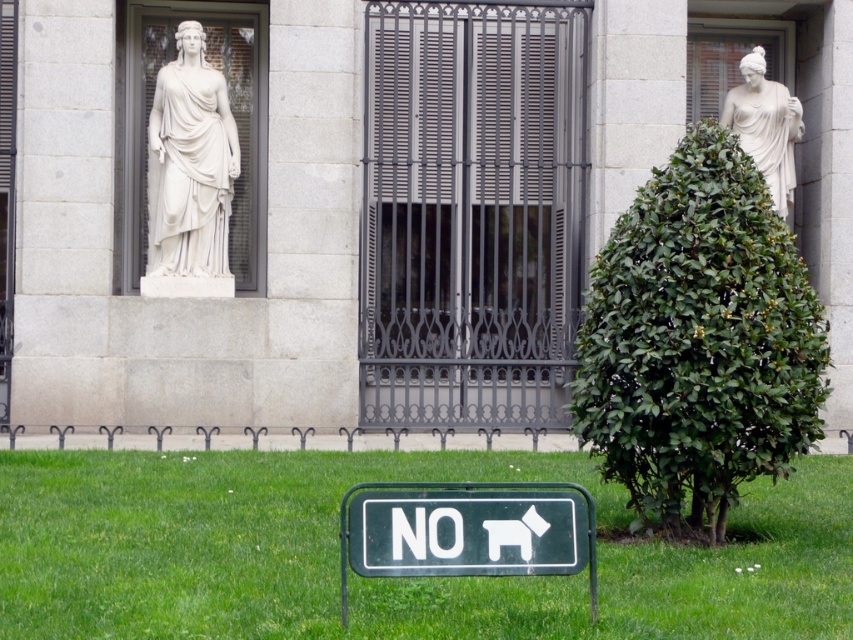
From the picture: You are standing at the entrance of the building and want to walk towards the point marked as point (223, 227). Will you pass by point (769, 106) before reaching your destination?

Point (223, 227) is in front of point (769, 106), so you will reach point (223, 227) before passing point (769, 106). Therefore, you will not pass by point (769, 106) before reaching your destination.

You are a landscape architect designing a pathway between the green grass at lower center and the white marble statue at upper right. Which area requires a wider path to accommodate visitors comfortably?

The green grass at lower center requires a wider path because its width surpasses that of the white marble statue at upper right, so a wider path would accommodate visitors more comfortably there.

You are an art student sketching the statues in the scene. You notice both the white marble statue at left and the white marble statue at upper right. Which statue should you focus on if you want to draw the taller one?

The white marble statue at left is much taller than the white marble statue at upper right, so you should focus on the white marble statue at left to draw the taller one.